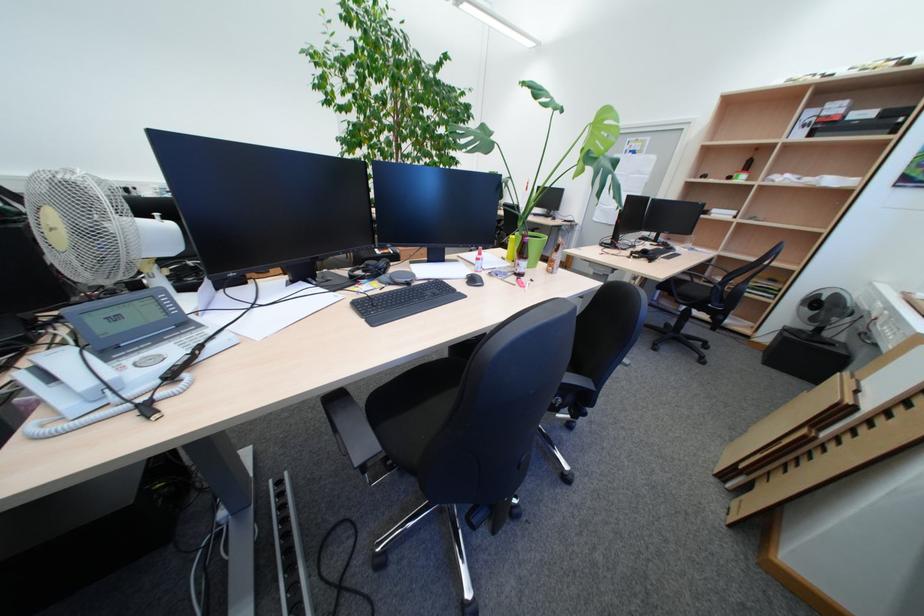
Locate an element on the screen. Image resolution: width=924 pixels, height=616 pixels. telephone handset is located at coordinates (79, 371).